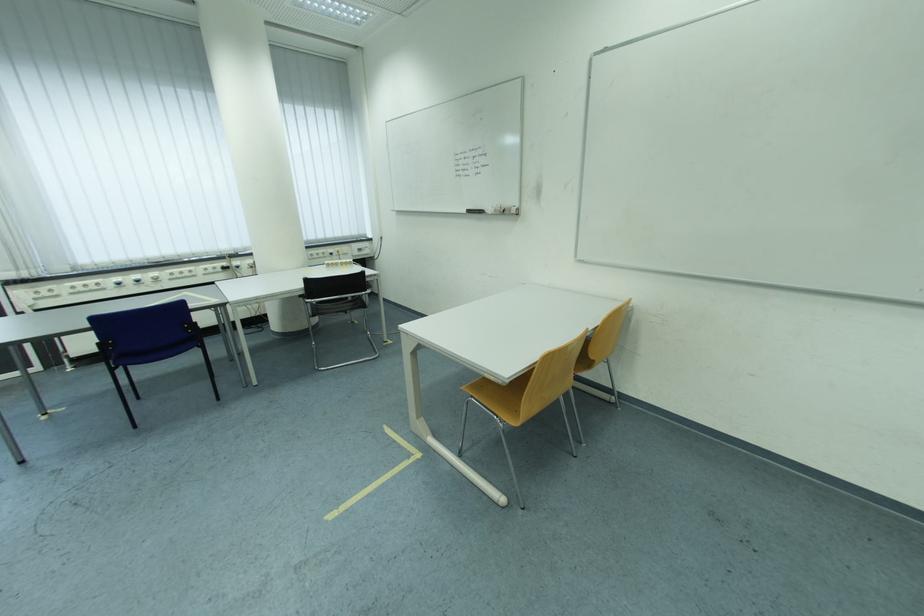
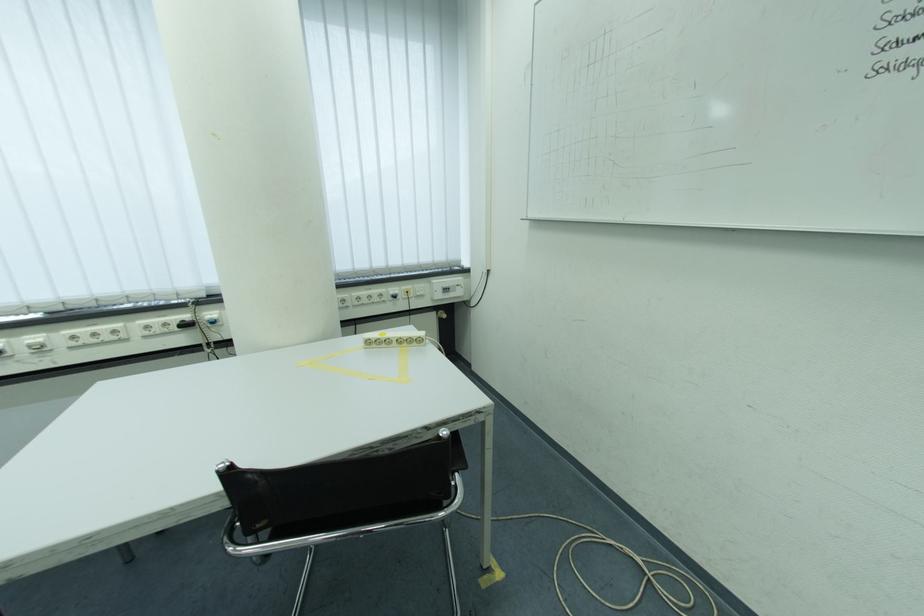
Where in the second image is the point corresponding to [369,253] from the first image?

(455, 292)